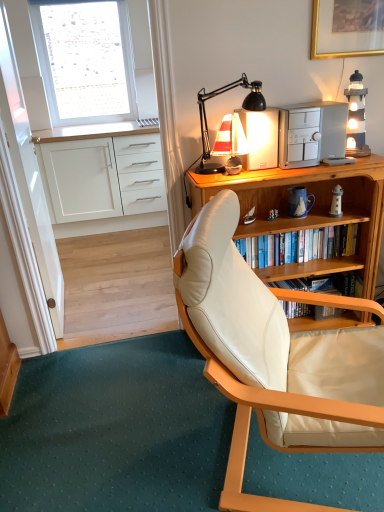
Question: Can you confirm if white plastic phone at upper right is thinner than transparent glass door at left?

Choices:
 (A) yes
 (B) no

Answer: (A)

Question: From the image's perspective, is white plastic phone at upper right below transparent glass door at left?

Choices:
 (A) no
 (B) yes

Answer: (B)

Question: Is white plastic phone at upper right bigger than transparent glass door at left?

Choices:
 (A) no
 (B) yes

Answer: (A)

Question: Considering the relative sizes of white plastic phone at upper right and transparent glass door at left in the image provided, is white plastic phone at upper right smaller than transparent glass door at left?

Choices:
 (A) yes
 (B) no

Answer: (A)

Question: Is white plastic phone at upper right not inside transparent glass door at left?

Choices:
 (A) yes
 (B) no

Answer: (A)

Question: Is white plastic phone at upper right oriented away from transparent glass door at left?

Choices:
 (A) yes
 (B) no

Answer: (B)

Question: Can you confirm if gold-framed picture at upper right is wider than white fabric window at upper left?

Choices:
 (A) yes
 (B) no

Answer: (B)

Question: Is gold-framed picture at upper right not inside white fabric window at upper left?

Choices:
 (A) yes
 (B) no

Answer: (A)

Question: Does gold-framed picture at upper right have a larger size compared to white fabric window at upper left?

Choices:
 (A) no
 (B) yes

Answer: (A)

Question: From a real-world perspective, is gold-framed picture at upper right on white fabric window at upper left?

Choices:
 (A) no
 (B) yes

Answer: (B)

Question: Is gold-framed picture at upper right positioned before white fabric window at upper left?

Choices:
 (A) yes
 (B) no

Answer: (A)

Question: Considering the relative sizes of gold-framed picture at upper right and white fabric window at upper left in the image provided, is gold-framed picture at upper right thinner than white fabric window at upper left?

Choices:
 (A) yes
 (B) no

Answer: (A)

Question: Could you tell me if transparent glass door at left is facing sailboat-patterned ceramic mug at upper right?

Choices:
 (A) no
 (B) yes

Answer: (A)